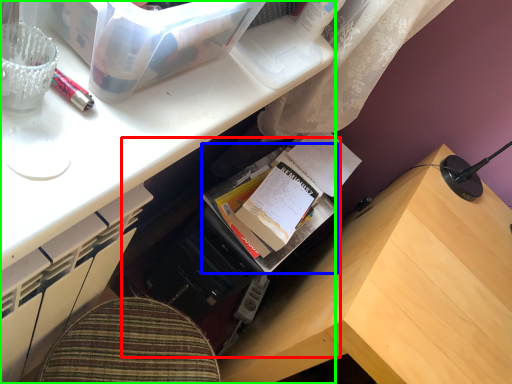
Question: Based on their relative distances, which object is farther from bookshelf (highlighted by a red box)? Choose from book (highlighted by a blue box) and desk (highlighted by a green box).

Choices:
 (A) book
 (B) desk

Answer: (B)